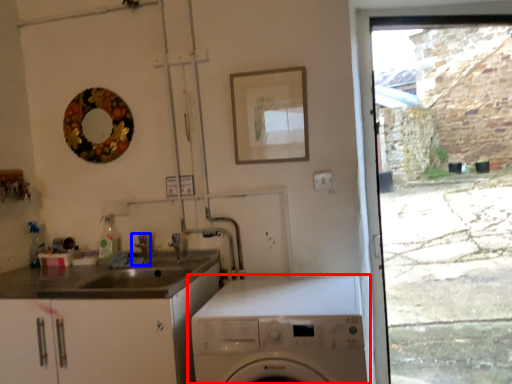
Question: Which of the following is the farthest to the observer, washing machine (highlighted by a red box) or tap (highlighted by a blue box)?

Choices:
 (A) washing machine
 (B) tap

Answer: (B)